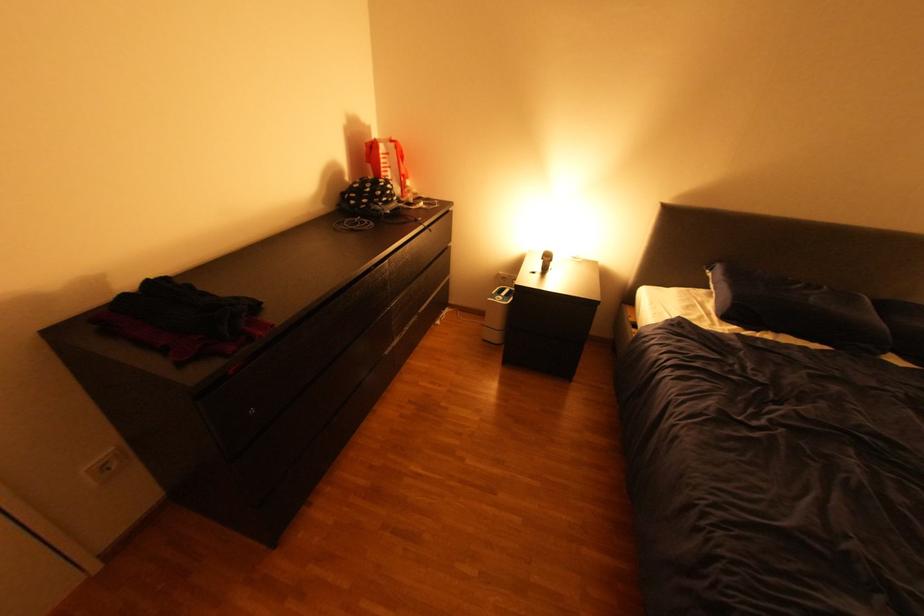
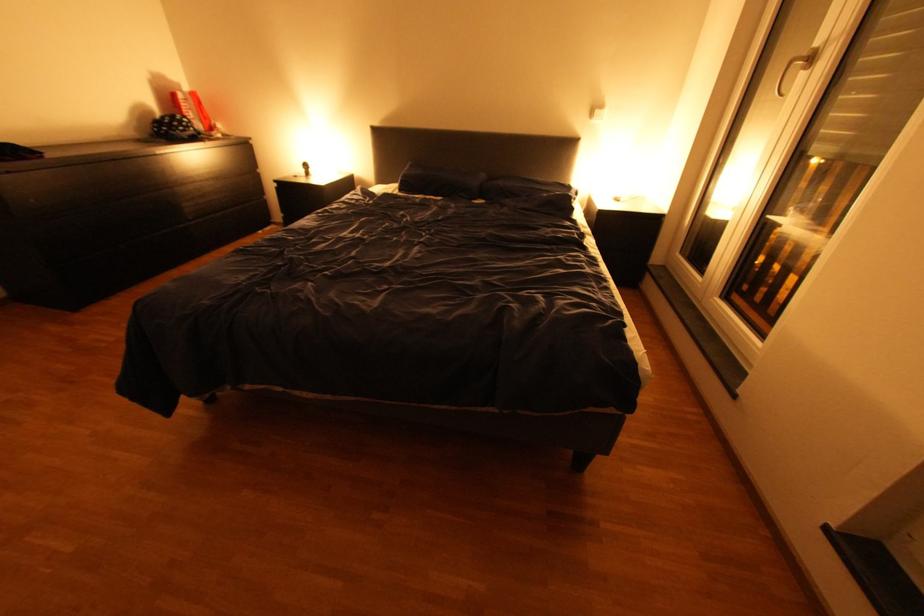
What movement of the cameraman would produce the second image?

The cameraman moved toward right, backward.